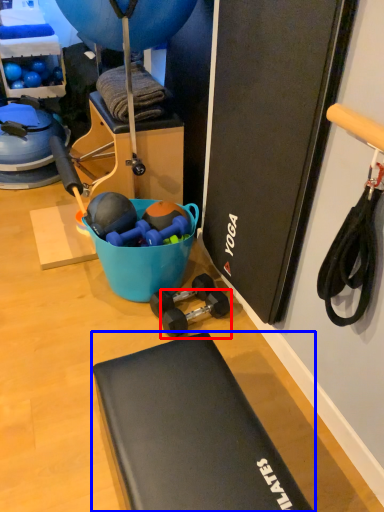
Question: Which object appears closest to the camera in this image, dumbbell (highlighted by a red box) or furniture (highlighted by a blue box)?

Choices:
 (A) dumbbell
 (B) furniture

Answer: (B)